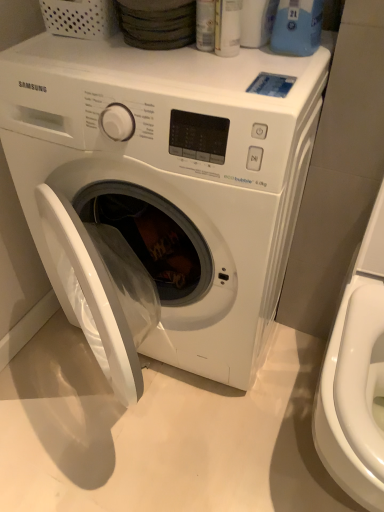
Question: Considering the relative sizes of white glossy washer at right and white glossy washing machine at center in the image provided, is white glossy washer at right smaller than white glossy washing machine at center?

Choices:
 (A) no
 (B) yes

Answer: (B)

Question: From the image's perspective, is white glossy washer at right located above white glossy washing machine at center?

Choices:
 (A) no
 (B) yes

Answer: (A)

Question: Would you consider white glossy washer at right to be distant from white glossy washing machine at center?

Choices:
 (A) yes
 (B) no

Answer: (B)

Question: Is white glossy washer at right behind white glossy washing machine at center?

Choices:
 (A) yes
 (B) no

Answer: (B)

Question: Is white glossy washing machine at center surrounded by white glossy washer at right?

Choices:
 (A) yes
 (B) no

Answer: (B)

Question: In terms of height, does white glossy washer at right look taller or shorter compared to white glossy washing machine at center?

Choices:
 (A) tall
 (B) short

Answer: (A)

Question: From the image's perspective, is white glossy washer at right located above or below white glossy washing machine at center?

Choices:
 (A) above
 (B) below

Answer: (B)

Question: Looking at the image, does white glossy washer at right seem bigger or smaller compared to white glossy washing machine at center?

Choices:
 (A) big
 (B) small

Answer: (B)

Question: Considering their positions, is white glossy washer at right located in front of or behind white glossy washing machine at center?

Choices:
 (A) behind
 (B) front

Answer: (B)

Question: Does point (286, 34) appear closer or farther from the camera than point (268, 225)?

Choices:
 (A) farther
 (B) closer

Answer: (A)

Question: From the image's perspective, relative to white glossy washing machine at center, is blue plastic bottle at upper right above or below?

Choices:
 (A) above
 (B) below

Answer: (A)

Question: From a real-world perspective, is blue plastic bottle at upper right above or below white glossy washing machine at center?

Choices:
 (A) above
 (B) below

Answer: (A)

Question: Looking at the image, does blue plastic bottle at upper right seem bigger or smaller compared to white glossy washing machine at center?

Choices:
 (A) small
 (B) big

Answer: (A)

Question: Is white glossy washer at right taller or shorter than blue plastic bottle at upper right?

Choices:
 (A) short
 (B) tall

Answer: (B)

Question: In the image, is white glossy washer at right positioned in front of or behind blue plastic bottle at upper right?

Choices:
 (A) front
 (B) behind

Answer: (A)